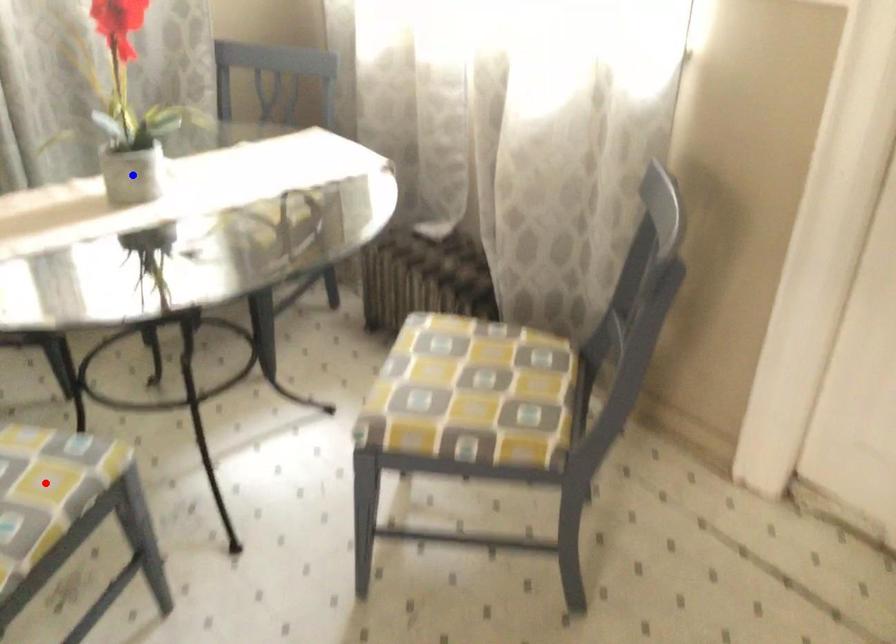
Question: Which of the two points in the image is closer to the camera?

Choices:
 (A) Blue point is closer.
 (B) Red point is closer.

Answer: (B)